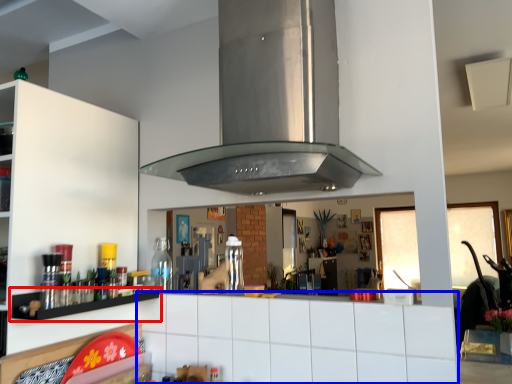
Question: Which point is further to the camera, shelf (highlighted by a red box) or counter top (highlighted by a blue box)?

Choices:
 (A) shelf
 (B) counter top

Answer: (A)